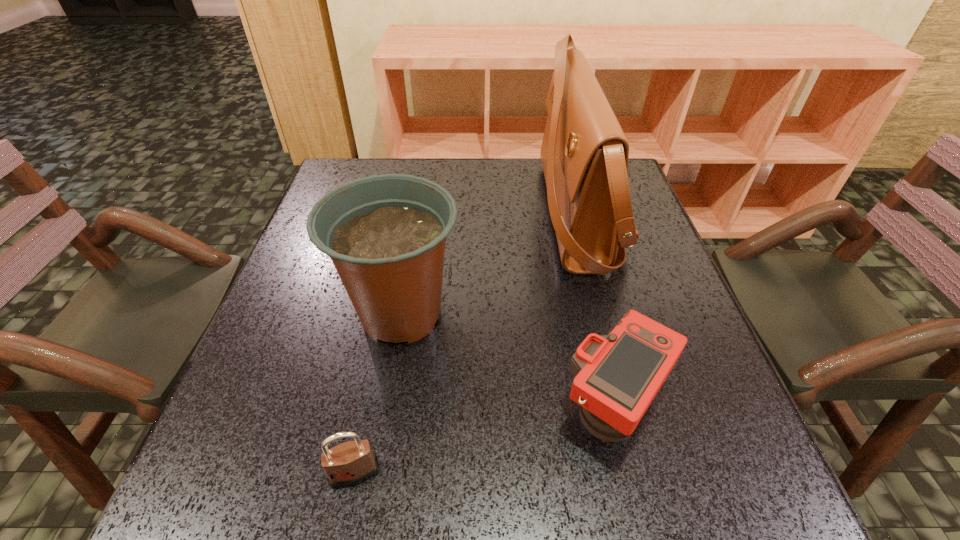
Identify the location of satchel. The height and width of the screenshot is (540, 960). (584, 153).

Image resolution: width=960 pixels, height=540 pixels. Find the location of `the third shortest object`. the third shortest object is located at coordinates click(385, 234).

The height and width of the screenshot is (540, 960). I want to click on camera, so click(617, 376).

Locate an element on the screen. This screenshot has height=540, width=960. padlock is located at coordinates (350, 463).

Locate an element on the screen. The height and width of the screenshot is (540, 960). vacant space located on the front flap of the satchel is located at coordinates (510, 215).

Locate an element on the screen. Image resolution: width=960 pixels, height=540 pixels. free space located on the front flap of the satchel is located at coordinates (451, 215).

Locate an element on the screen. This screenshot has height=540, width=960. vacant space located on the front flap of the satchel is located at coordinates (x=440, y=215).

You are a GUI agent. You are given a task and a screenshot of the screen. Output one action in this format:
    pyautogui.click(x=<x>, y=<y>)
    Task: Click on the free space located on the right of the flowerpot
    
    Given the screenshot: What is the action you would take?
    pyautogui.click(x=562, y=314)

The height and width of the screenshot is (540, 960). I want to click on vacant area situated 0.220m on the back of the camera, so click(x=583, y=275).

What are the coordinates of `free spot located on the back of the shortest object` in the screenshot? It's located at (390, 297).